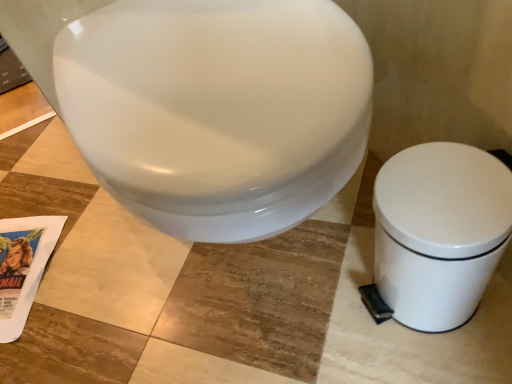
The width and height of the screenshot is (512, 384). Find the location of `free space behind white glossy trash can at lower right`. free space behind white glossy trash can at lower right is located at coordinates (345, 223).